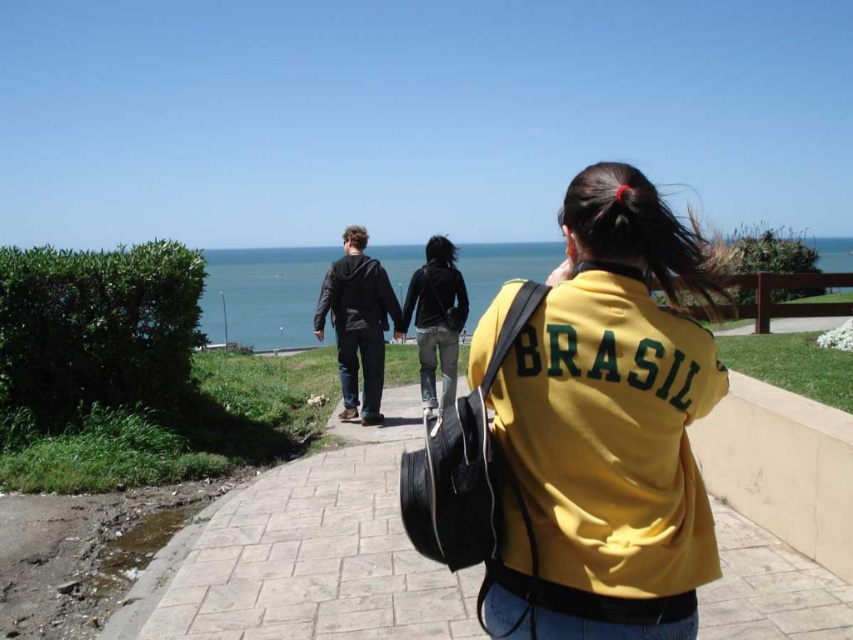
Where is `blue water at center`? Image resolution: width=853 pixels, height=640 pixels. blue water at center is located at coordinates (263, 294).

Between blue water at center and dark gray hoodie at center, which one appears on the left side from the viewer's perspective?

dark gray hoodie at center

Is point (289, 284) less distant than point (347, 262)?

No, it is behind (347, 262).

Locate an element on the screen. blue water at center is located at coordinates (263, 294).

What do you see at coordinates (613, 419) in the screenshot?
I see `yellow fabric jacket at center` at bounding box center [613, 419].

Does point (519, 580) come farther from viewer compared to point (323, 476)?

No.

You are a GUI agent. You are given a task and a screenshot of the screen. Output one action in this format:
    pyautogui.click(x=<x>, y=<y>)
    Task: Click on the yellow fabric jacket at center
    The height and width of the screenshot is (640, 853).
    Given the screenshot: What is the action you would take?
    pyautogui.click(x=613, y=419)

Can you confirm if yellow fabric jacket at center is wider than dark gray hoodie at center?

No, yellow fabric jacket at center is not wider than dark gray hoodie at center.

Which is in front, point (573, 556) or point (350, 337)?

Point (573, 556)

Which is in front, point (509, 582) or point (352, 308)?

Point (509, 582) is more forward.

The width and height of the screenshot is (853, 640). I want to click on yellow fabric jacket at center, so coord(613,419).